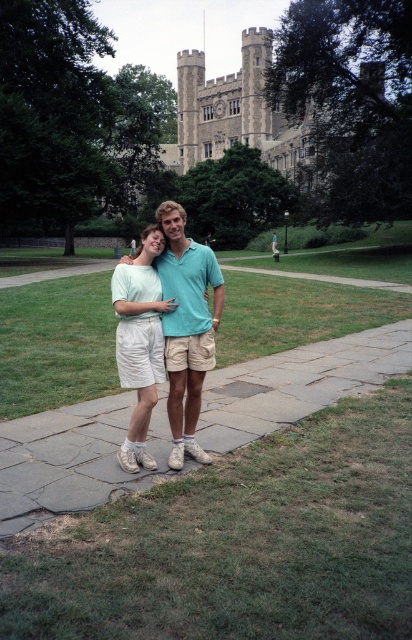
You are a photographer trying to capture a photo of the light blue cotton shirt at center and the gray stone pavement at center. Since you want to focus on the shirt, which object should you move closer to in the scene?

The light blue cotton shirt at center is behind the gray stone pavement at center, so you should move closer to the light blue cotton shirt at center to focus on it better.

You are standing on the pathway and want to walk from point (264, 408) to point (170, 285). Which direction should you face to move towards the closer point?

Point (170, 285) is closer to you than point (264, 408). To move towards the closer point, you should face away from the historic building and towards the pathway leading towards it.